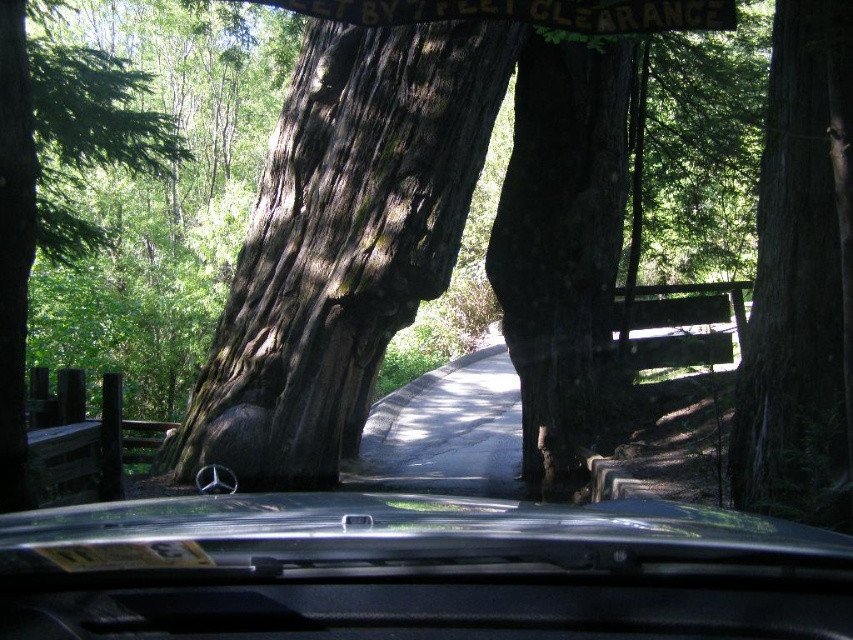
Question: Can you confirm if black metallic car at center is smaller than smooth brown bark at right?

Choices:
 (A) no
 (B) yes

Answer: (A)

Question: Is black metallic car at center smaller than dark brown textured bark at center?

Choices:
 (A) yes
 (B) no

Answer: (A)

Question: Estimate the real-world distances between objects in this image. Which object is closer to the smooth brown bark at right?

Choices:
 (A) black metallic car at center
 (B) green rough bark tree at center

Answer: (A)

Question: Among these points, which one is farthest from the camera?

Choices:
 (A) (138, 163)
 (B) (271, 204)
 (C) (331, 600)
 (D) (779, 371)

Answer: (A)

Question: Among these objects, which one is nearest to the camera?

Choices:
 (A) smooth brown bark at right
 (B) dark brown textured bark at center

Answer: (A)

Question: Is the position of dark brown textured bark at center more distant than that of smooth brown bark at right?

Choices:
 (A) yes
 (B) no

Answer: (A)